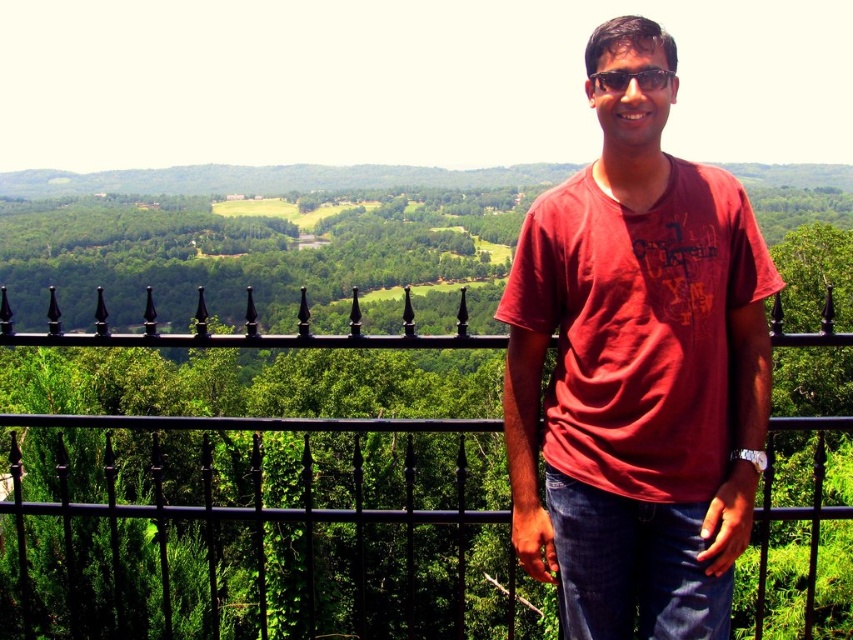
Question: In this image, where is matte red t-shirt at center located relative to black wrought iron fence at center?

Choices:
 (A) right
 (B) left

Answer: (A)

Question: Is matte red t-shirt at center closer to camera compared to black wrought iron fence at center?

Choices:
 (A) no
 (B) yes

Answer: (B)

Question: Is matte red t-shirt at center bigger than black wrought iron fence at center?

Choices:
 (A) no
 (B) yes

Answer: (A)

Question: Which object appears closest to the camera in this image?

Choices:
 (A) matte red t-shirt at center
 (B) black wrought iron fence at center

Answer: (A)